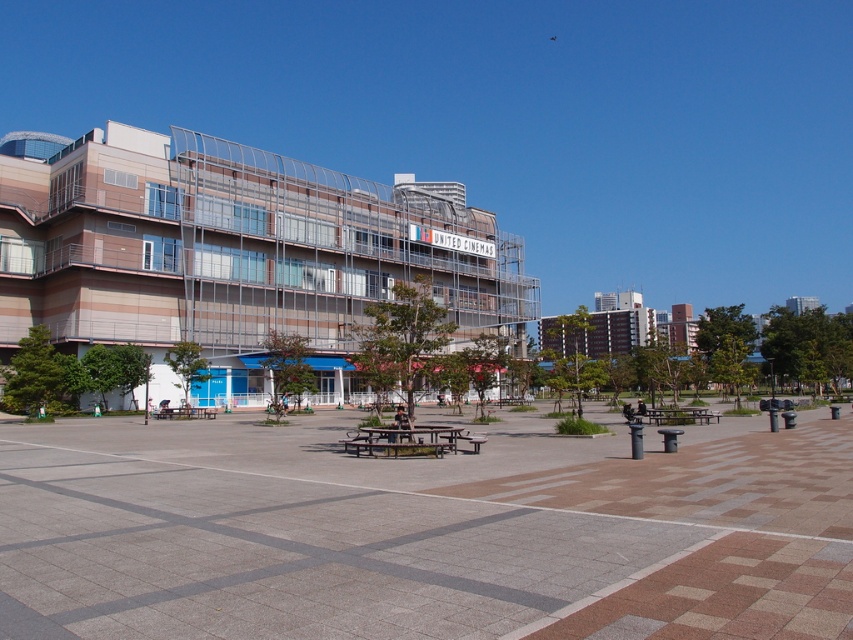
Which is more to the left, concrete paving at center or wooden picnic table at center?

concrete paving at center is more to the left.

Does concrete paving at center have a larger size compared to wooden picnic table at center?

Indeed, concrete paving at center has a larger size compared to wooden picnic table at center.

Which is in front, point (381, 602) or point (405, 435)?

Point (381, 602)

This screenshot has height=640, width=853. I want to click on concrete paving at center, so click(422, 531).